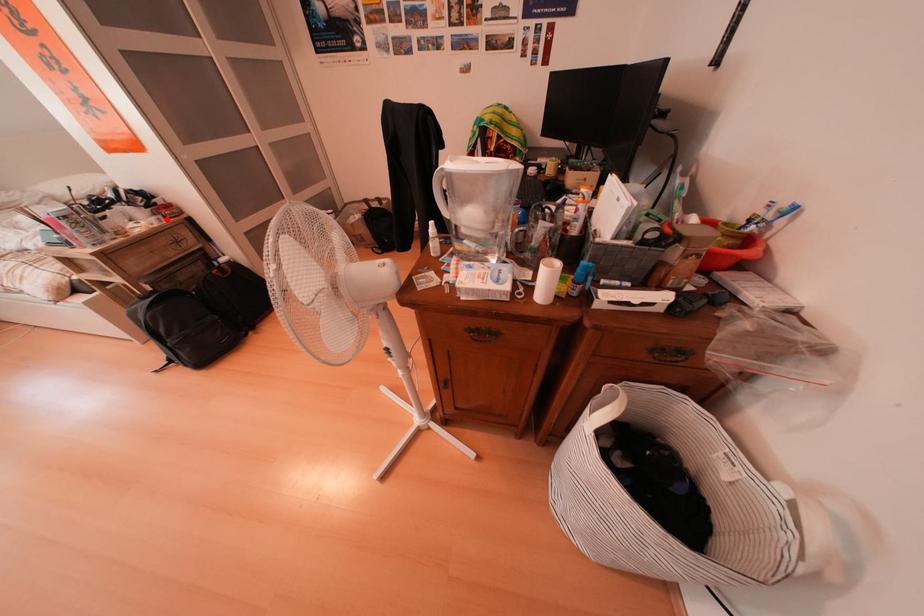
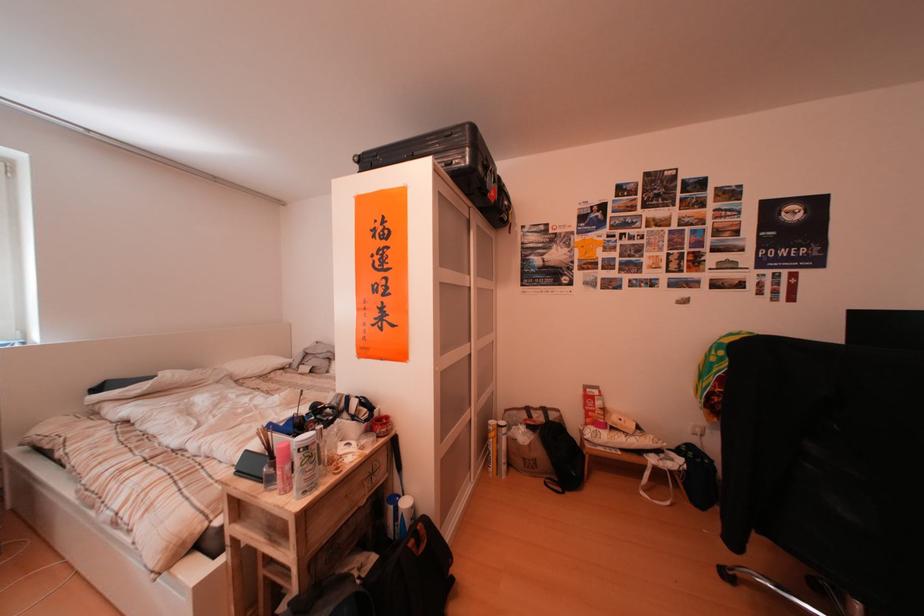
The point at the highlighted location is marked in the first image. Where is the corresponding point in the second image?

(381, 436)